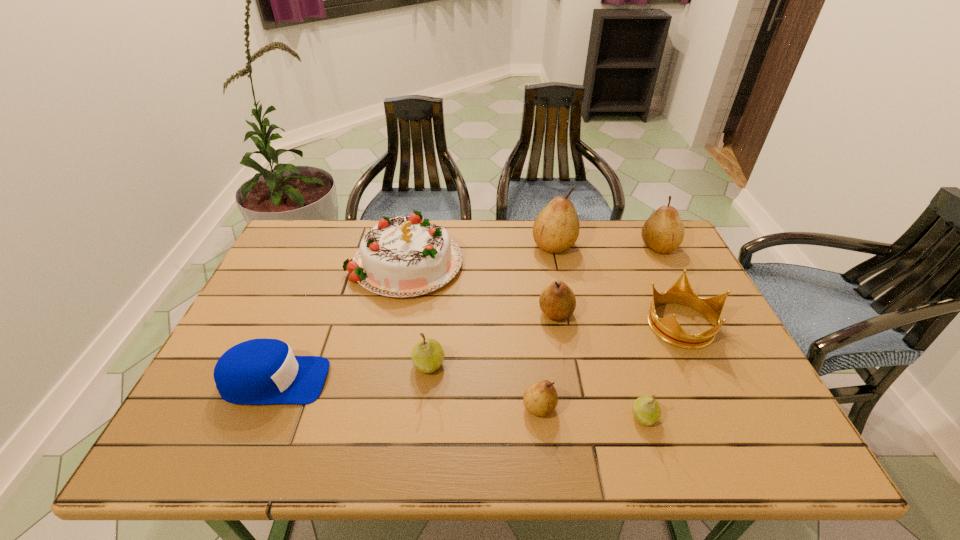
At what (x,y) coordinates should I click in order to perform the action: click on the tallest pear. Please return your answer as a coordinate pair (x, y). The width and height of the screenshot is (960, 540). Looking at the image, I should click on (556, 228).

Identify the location of cake. This screenshot has height=540, width=960. (405, 256).

The image size is (960, 540). In order to click on the rightmost pear in this screenshot , I will do `click(663, 232)`.

Locate an element on the screen. The image size is (960, 540). the second tallest pear is located at coordinates (663, 232).

Where is `the second nearest brown pear`? This screenshot has height=540, width=960. the second nearest brown pear is located at coordinates (557, 301).

Identify the location of the fourth nearest pear. (557, 301).

You are a GUI agent. You are given a task and a screenshot of the screen. Output one action in this format:
    pyautogui.click(x=<x>, y=<y>)
    Task: Click on the bigger green pear
    
    Given the screenshot: What is the action you would take?
    pyautogui.click(x=427, y=355)

Find the location of a particular element. the leftmost pear is located at coordinates (427, 355).

This screenshot has height=540, width=960. What are the coordinates of `gold crown` in the screenshot? It's located at (668, 329).

Locate an element on the screen. blue baseball cap is located at coordinates (260, 371).